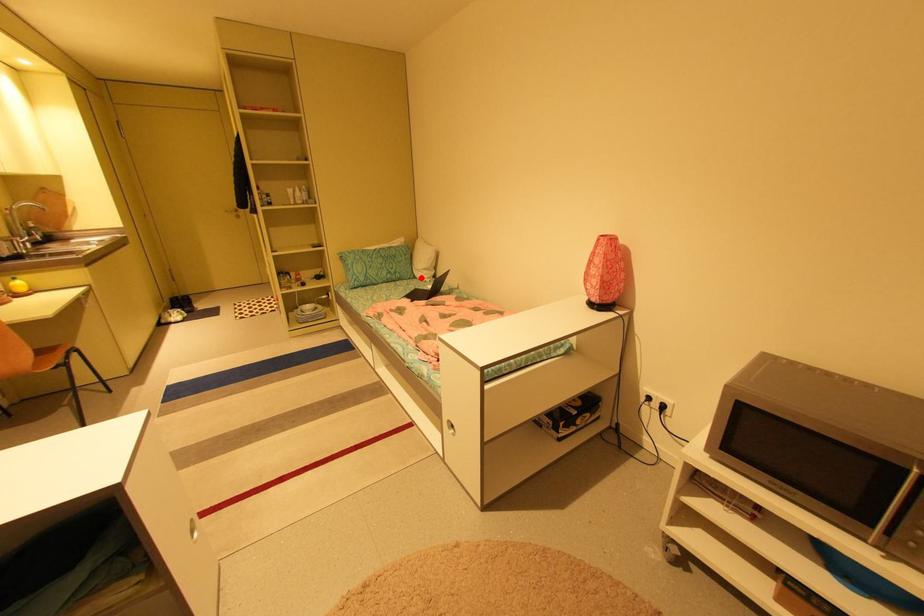
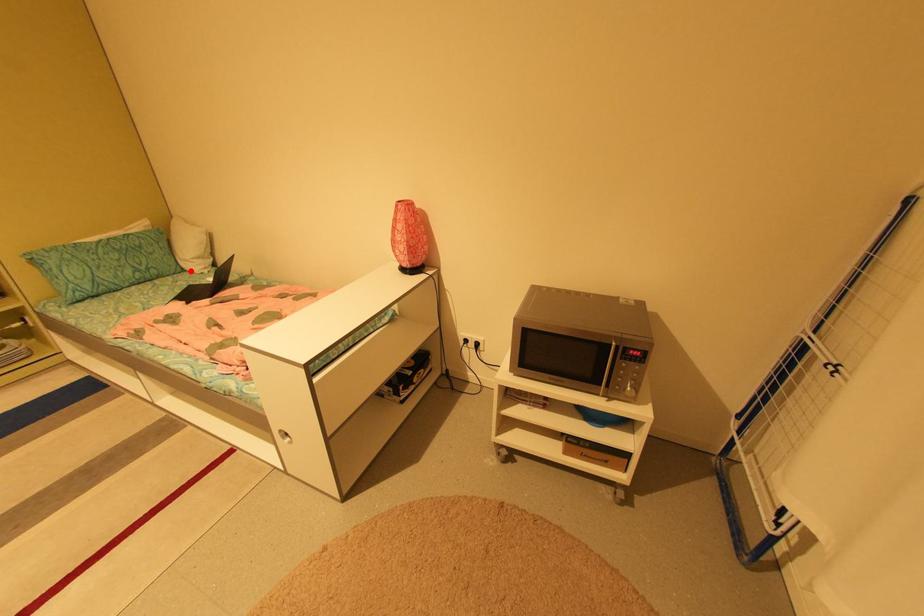
I am providing you with two images of the same scene from different viewpoints. A red point is marked on the first image and another point is marked on the second image. Are the points marked in image1 and image2 representing the same 3D position?

Yes